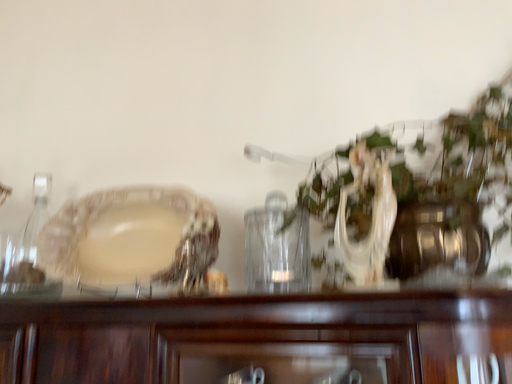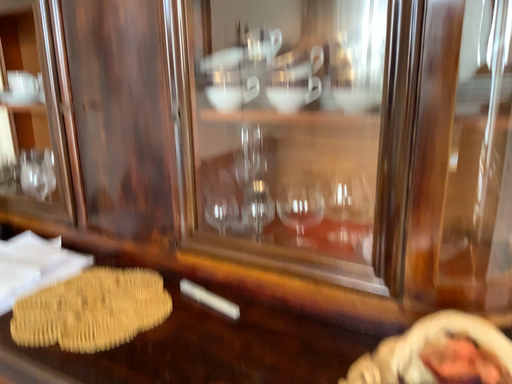
Question: How did the camera likely rotate when shooting the video?

Choices:
 (A) rotated downward
 (B) rotated upward

Answer: (A)